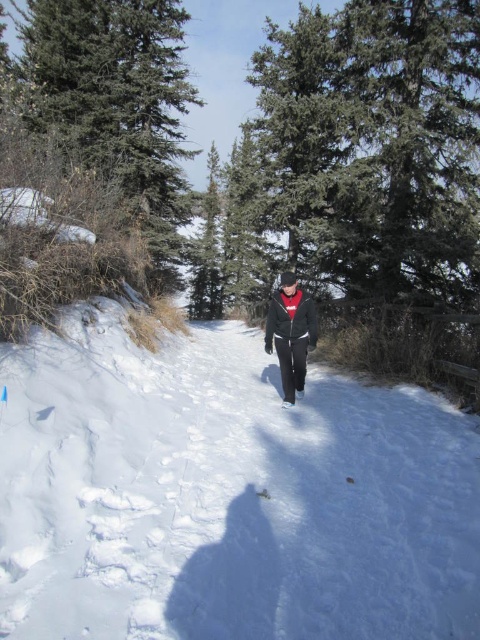
You are a photographer trying to capture the green matte tree at upper left and the black matte jacket at center in the same frame. Which object will appear bigger in the photo?

The green matte tree at upper left will appear bigger in the photo because it has a larger size compared to the black matte jacket at center.

You are a photographer trying to capture the contrast between the white fluffy snow at center and the black matte jacket at center. Which object appears wider in the image?

The black matte jacket at center appears wider than the white fluffy snow at center in the image.